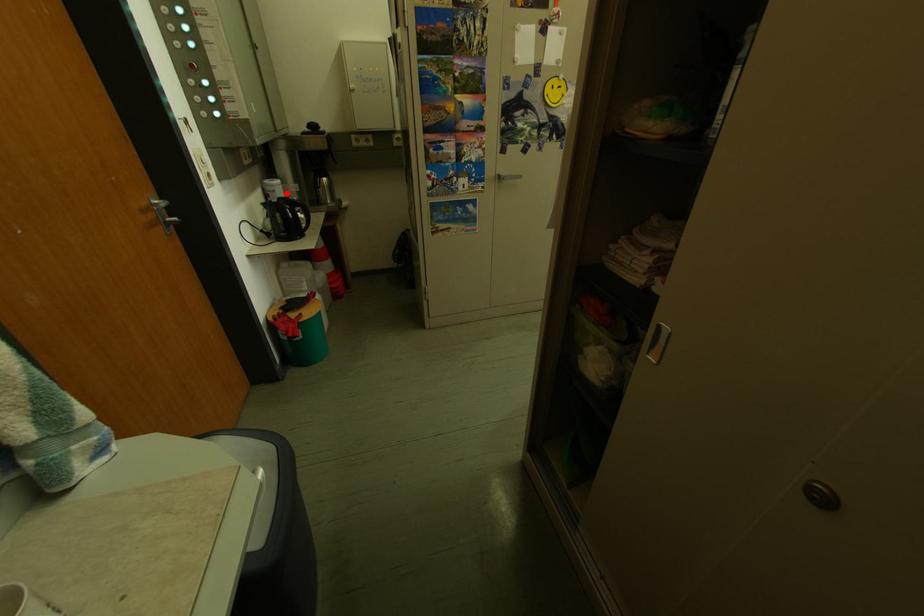
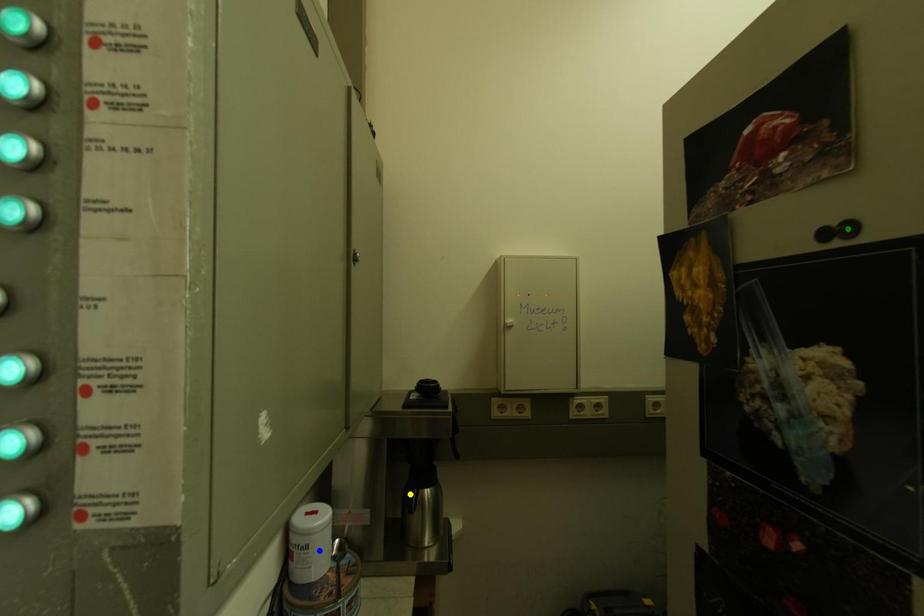
Question: I am providing you with two images of the same scene from different viewpoints. A red point is marked on the first image. You are given multiple points on the second image. Which mark in image 2 goes with the point in image 1?

Choices:
 (A) green point
 (B) blue point
 (C) yellow point

Answer: (B)